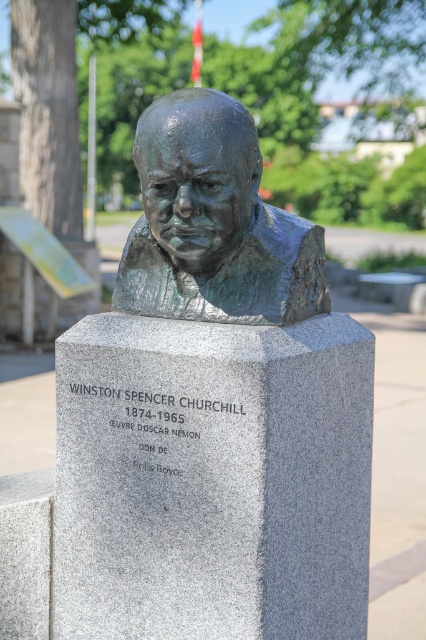
You are an art curator planning to display the bronze bust at center and the bronze sculpture at center in a new exhibition. Given their sizes, which one would you place on the taller stand to ensure proper visibility?

The bronze bust at center has a larger size compared to bronze sculpture at center, so placing it on the taller stand would ensure proper visibility.